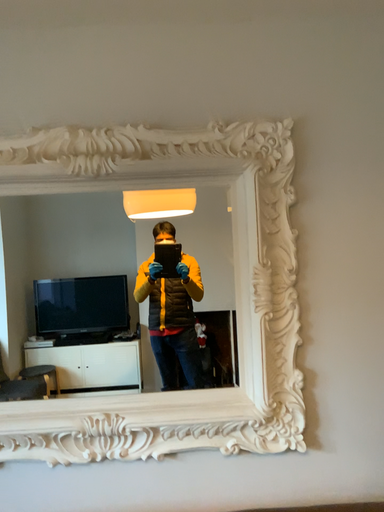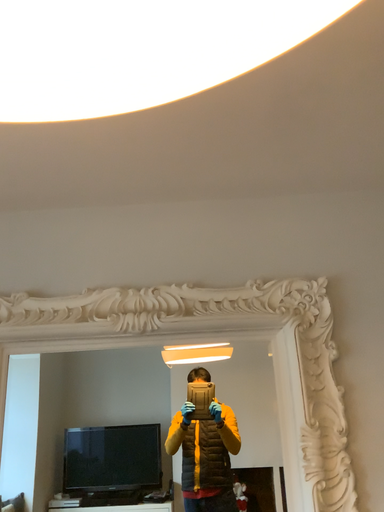
Question: How did the camera likely rotate when shooting the video?

Choices:
 (A) rotated downward
 (B) rotated upward

Answer: (B)